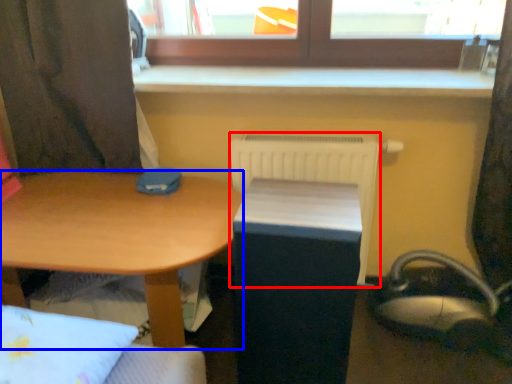
Question: Which object appears closest to the camera in this image, radiator (highlighted by a red box) or desk (highlighted by a blue box)?

Choices:
 (A) radiator
 (B) desk

Answer: (B)